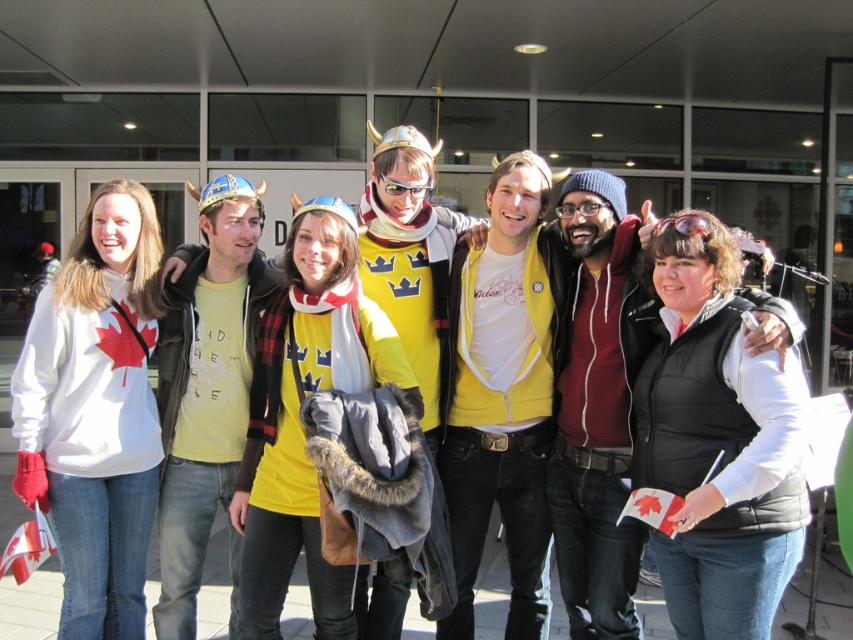
Between point (625, 262) and point (196, 336), which one is positioned behind?

Point (196, 336)

Is point (778, 340) more distant than point (263, 262)?

That is False.

Measure the distance between point (x=598, y=548) and camera.

Point (x=598, y=548) and camera are 10.07 feet apart from each other.

Find the location of `matte black jacket at center`. matte black jacket at center is located at coordinates (598, 404).

Is yellow zip-up hoodie at center further to camera compared to yellow matte shirt at center?

No, it is in front of yellow matte shirt at center.

Image resolution: width=853 pixels, height=640 pixels. What do you see at coordinates (505, 392) in the screenshot? I see `yellow zip-up hoodie at center` at bounding box center [505, 392].

Which is behind, point (520, 417) or point (426, 166)?

Point (426, 166)

Find the location of a particular element. yellow zip-up hoodie at center is located at coordinates (505, 392).

Is point (514, 240) positioned in front of point (575, 547)?

No, it is not.

How distant is yellow zip-up hoodie at center from matte black jacket at center?

The distance of yellow zip-up hoodie at center from matte black jacket at center is 6.01 inches.

Image resolution: width=853 pixels, height=640 pixels. What do you see at coordinates (505, 392) in the screenshot? I see `yellow zip-up hoodie at center` at bounding box center [505, 392].

What are the coordinates of `yellow zip-up hoodie at center` in the screenshot? It's located at (505, 392).